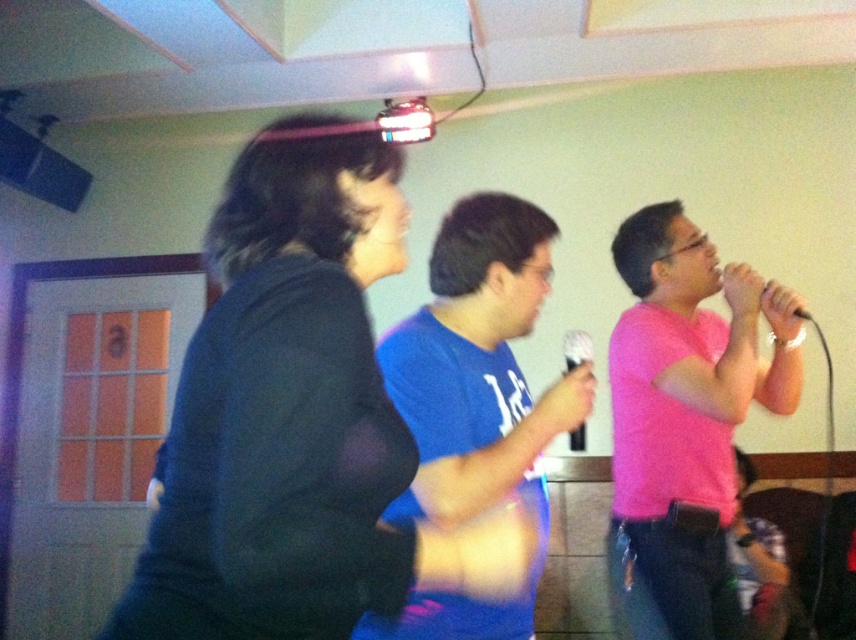
You are standing in the room and want to move from the point at the bottom right corner to the door located at the top left corner. There are two points marked in the scene at coordinates point (676, 300) and point (569, 360). Which point should you avoid stepping on to ensure a clear path towards the door?

You should avoid stepping on point (676, 300) because it is behind point (569, 360), which might block your path towards the door.

In the karaoke scene, you notice the blue cotton shirt at center and the black plastic microphone at center. Which object is taller?

The blue cotton shirt at center is taller than the black plastic microphone at center.

You are a photographer trying to capture a candid shot of the pink matte shirt at center and the black plastic microphone at center during a karaoke session. Which object should you focus on first if you want to include both in the frame without moving the camera?

The pink matte shirt at center is positioned on the right side of the black plastic microphone at center, so you should focus on the black plastic microphone at center first to ensure both are in the frame without moving the camera.